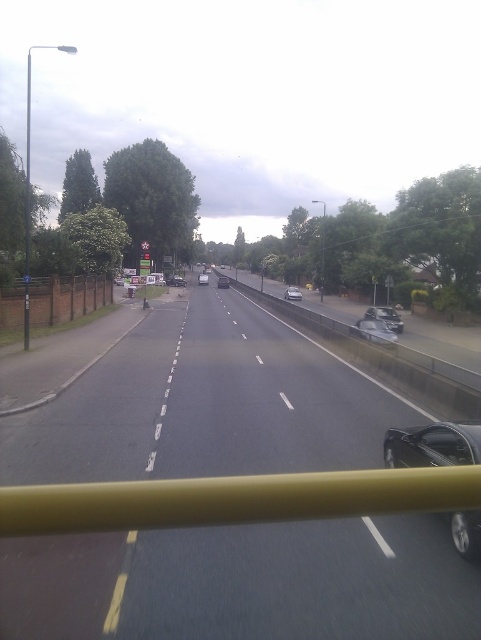
Which is in front, point (479, 433) or point (452, 353)?

Positioned in front is point (479, 433).

Is shiny black car at center positioned behind black asphalt road at center?

No, it is not.

Is point (382, 442) positioned after point (269, 294)?

No, (382, 442) is in front of (269, 294).

Locate an element on the screen. shiny black car at center is located at coordinates (432, 445).

Between shiny black car at center and white matte van at center, which one appears on the left side from the viewer's perspective?

white matte van at center is more to the left.

Is shiny black car at center wider than white matte van at center?

In fact, shiny black car at center might be narrower than white matte van at center.

Between point (456, 444) and point (116, 284), which one is positioned behind?

The point (116, 284) is behind.

At what (x,y) coordinates should I click in order to perform the action: click on shiny black car at center. Please return your answer as a coordinate pair (x, y). Looking at the image, I should click on (432, 445).

Is black asphalt road at center bigger than matte black car at center?

Yes, black asphalt road at center is bigger than matte black car at center.

Is black asphalt road at center positioned in front of matte black car at center?

Yes, it is.

Who is more distant from viewer, (316,314) or (227,282)?

The point (227,282) is behind.

Identify the location of black asphalt road at center. Image resolution: width=481 pixels, height=640 pixels. (447, 355).